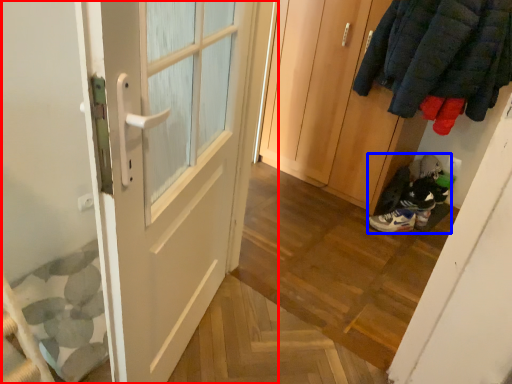
Question: Which object appears closest to the camera in this image, door (highlighted by a red box) or footwear (highlighted by a blue box)?

Choices:
 (A) door
 (B) footwear

Answer: (A)